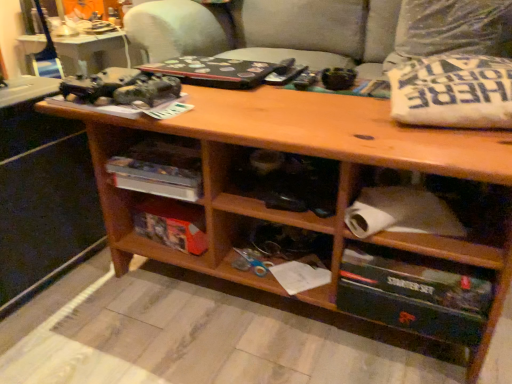
Identify the location of blank space situated above black cardboard starter set at lower right (from a real-world perspective). This screenshot has height=384, width=512. (416, 267).